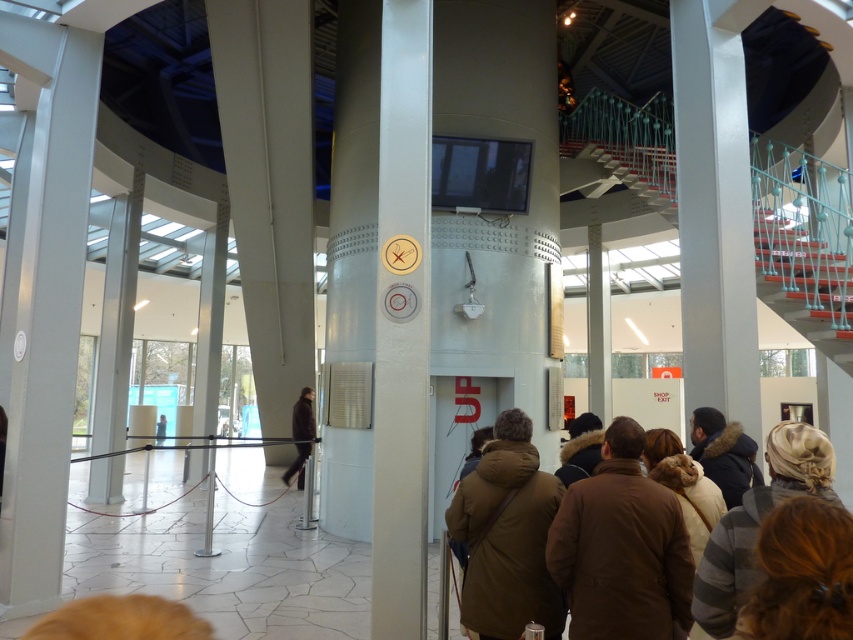
You are standing at the entrance of the modern building and want to locate the teal plastic staircase at upper right. According to the coordinates provided, where would you look to find it?

The teal plastic staircase at upper right is located at coordinates point (x=804, y=244), so you should look towards the upper right area of the image.

You are standing in the modern building and want to move from the point at coordinates point (611, 152) to the point at coordinates point (546, 557). Which direction should you move to get closer to your destination?

You should move towards the direction away from the camera because point (611, 152) is further to the camera than point (546, 557). Moving away from the camera will bring you closer to the destination.